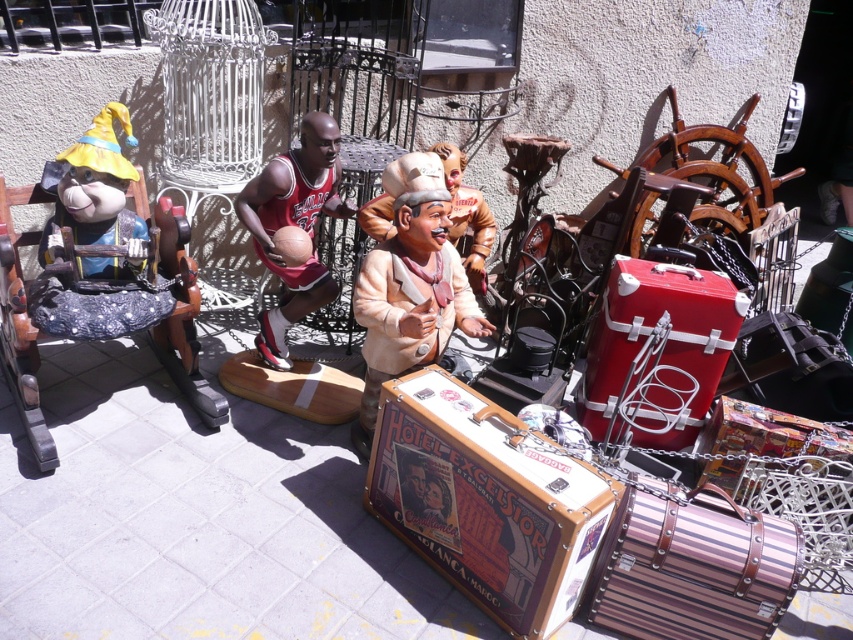
Does red jersey basketball player at center have a greater width compared to smooth leather suitcase at center?

Yes, red jersey basketball player at center is wider than smooth leather suitcase at center.

Looking at this image, can you confirm if red jersey basketball player at center is taller than smooth leather suitcase at center?

Yes, red jersey basketball player at center is taller than smooth leather suitcase at center.

Is point (258, 220) farther from camera compared to point (440, 515)?

Yes, point (258, 220) is farther from viewer.

At what (x,y) coordinates should I click in order to perform the action: click on red jersey basketball player at center. Please return your answer as a coordinate pair (x, y). Looking at the image, I should click on (294, 225).

Is wooden rocking horse at left positioned in front of brown matte statue at center?

No.

Which is more to the left, wooden rocking horse at left or brown matte statue at center?

From the viewer's perspective, wooden rocking horse at left appears more on the left side.

The width and height of the screenshot is (853, 640). Describe the element at coordinates (99, 275) in the screenshot. I see `wooden rocking horse at left` at that location.

Locate an element on the screen. This screenshot has height=640, width=853. wooden rocking horse at left is located at coordinates (99, 275).

Which is behind, point (439, 208) or point (251, 225)?

Point (251, 225)

Is point (418, 323) behind point (277, 332)?

No, it is in front of (277, 332).

Who is more forward, (428, 232) or (270, 340)?

Point (428, 232) is in front.

Find the location of a particular element. The image size is (853, 640). brown matte statue at center is located at coordinates (410, 284).